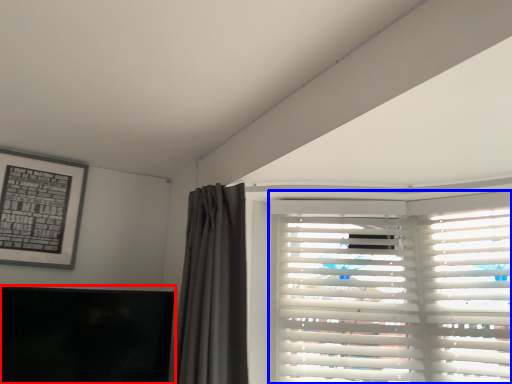
Question: Which point is further to the camera, window screen (highlighted by a red box) or window blind (highlighted by a blue box)?

Choices:
 (A) window screen
 (B) window blind

Answer: (B)